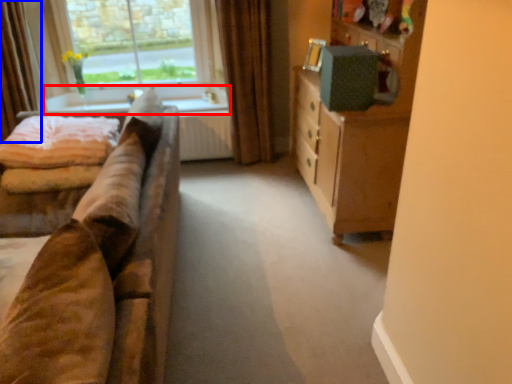
Question: Which object is further to the camera taking this photo, window sill (highlighted by a red box) or curtain (highlighted by a blue box)?

Choices:
 (A) window sill
 (B) curtain

Answer: (A)